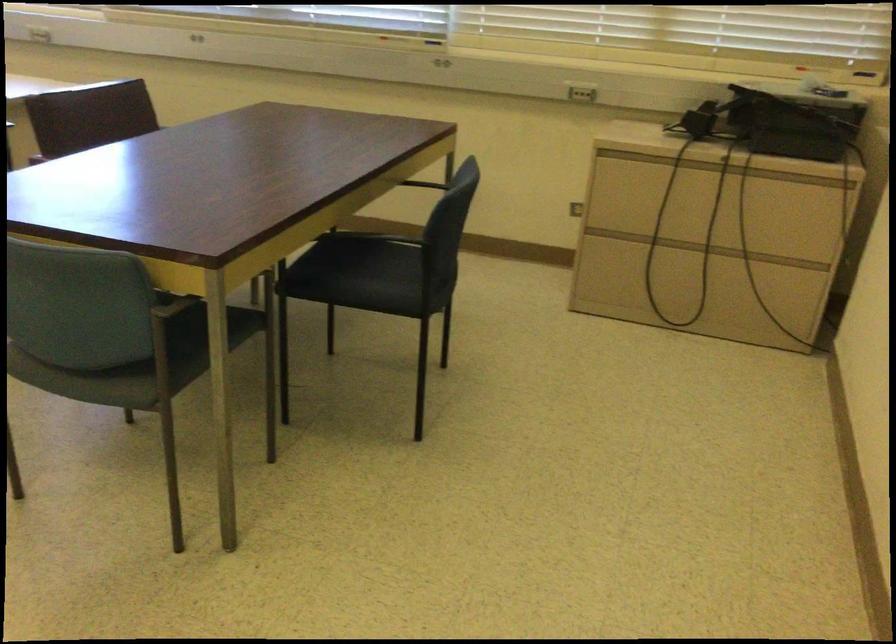
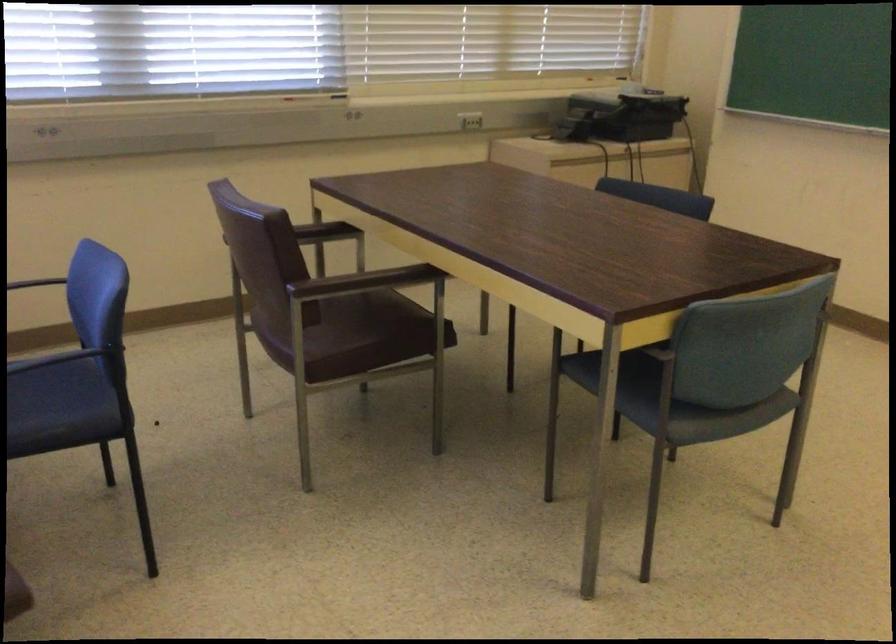
Question: I am providing you with two images of the same scene from different viewpoints. Please identify which objects are invisible in image2.

Choices:
 (A) metallic faucet handle
 (B) green chair sitting surface
 (C) dark blue sitting surface
 (D) black chair armrest

Answer: (B)